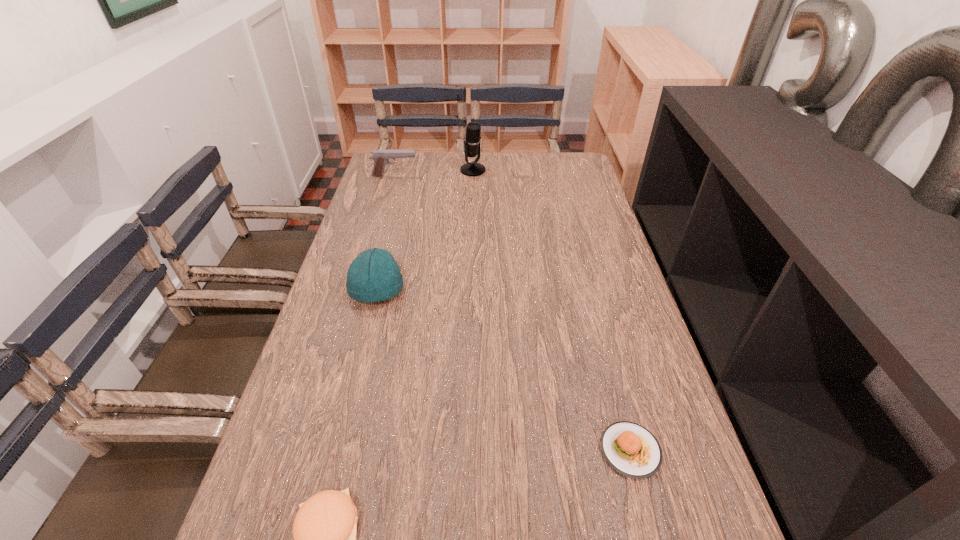
I want to click on vacant area in the image that satisfies the following two spatial constraints: 1. on the back side of the right food; 2. at the barrel of the pistol, so click(558, 176).